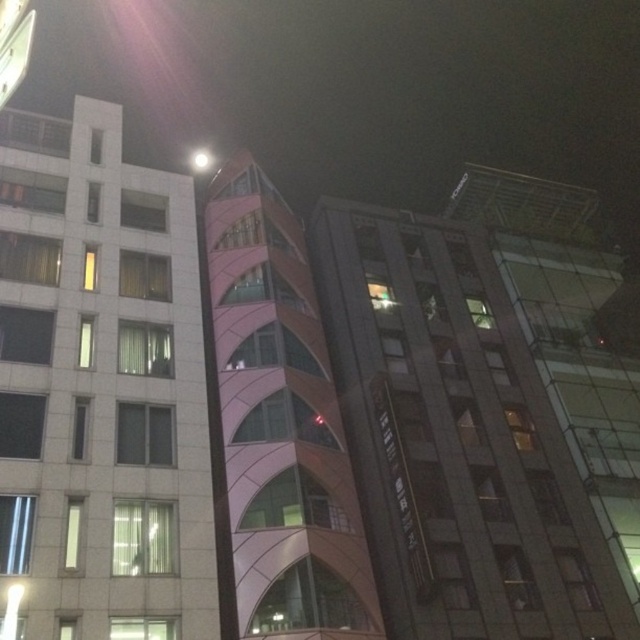
Based on the photo, you are a drone operator tasked with flying a drone from the white glossy building at left to the pink glass building at center. The drone has a maximum flight range of 20 meters. Can the drone reach its destination without needing to recharge?

The pink glass building at center is 19.54 meters from white glossy building at left. Since the distance is within the drone operator drone has a maximum flight range of 20 meters, the drone can reach the pink glass building at center without needing to recharge.

You are an architect analyzing the urban layout. You notice the white glossy building at left and the pink glass tower at center. Which building is placed above the other in the image?

The white glossy building at left is positioned over the pink glass tower at center, meaning it is placed above the tower in the image.

You are an architect analyzing the urban layout. Given that the pink glass building at center and the pink glass tower at center are both illuminated at night, which one would likely cast a broader light footprint on the adjacent streets due to its size?

The pink glass building at center is larger in size than the pink glass tower at center, so it would likely cast a broader light footprint on the adjacent streets.